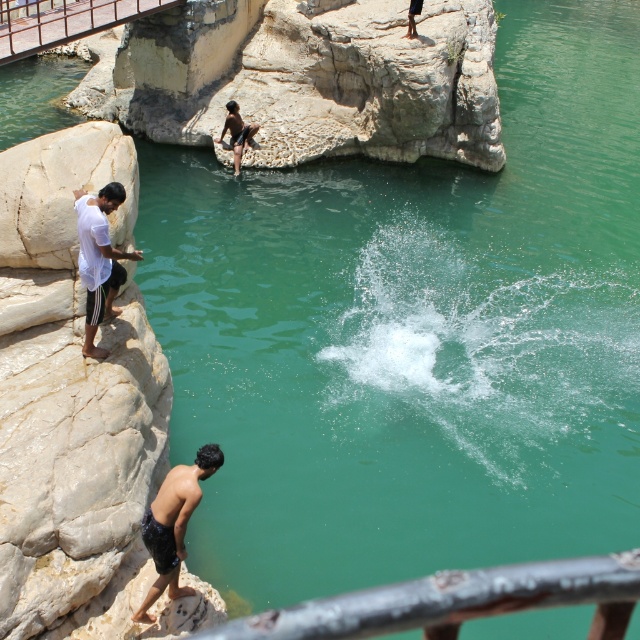
From the picture: You are a safety inspector evaluating the waterfront area. You notice two metal rails in the scene. The first is the rusty metal rail at lower center, and the second is the brushed metal rail at upper left. Based on their widths, which rail might be more stable for supporting weight?

The rusty metal rail at lower center has a greater width than the brushed metal rail at upper left, so it is likely more stable for supporting weight.

You are navigating a drone over the rocky waterfront scene. You need to drop a buoy into the water near the white matte shorts at left. Based on the coordinates provided, in which direction should you fly the drone to reach the correct drop zone?

The white matte shorts at left is located at point (99,259). Since the coordinates are relative to the image, the x value 0.406 indicates it is 40.6 percent from the left edge, and the y value 0.156 means it is 15.6 percent from the top. To drop the buoy near the white matte shorts at left, fly the drone to the left side of the image, approximately 40.6 percent from the left edge and 15.6 percent down from the top.

You are a visitor at the waterfront and want to take a photo of the black matte shorts at lower left without including the brushed metal rail at upper left in the frame. Based on their positions, is this possible?

The brushed metal rail at upper left is to the left of the black matte shorts at lower left. Therefore, by positioning the camera to the right side of the black matte shorts at lower left and framing the shot to exclude the area to the left, it should be possible to capture the black matte shorts at lower left without the brushed metal rail at upper left in the image.